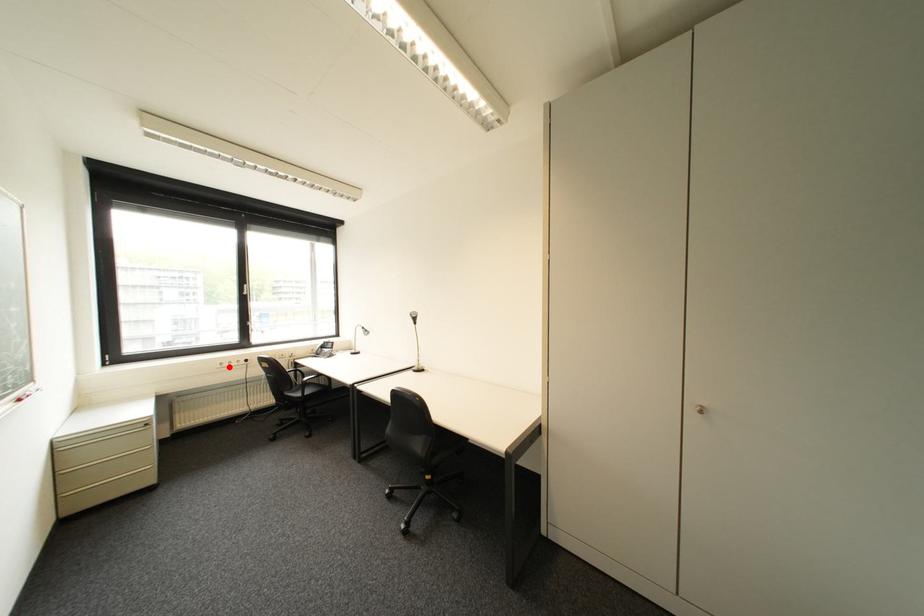
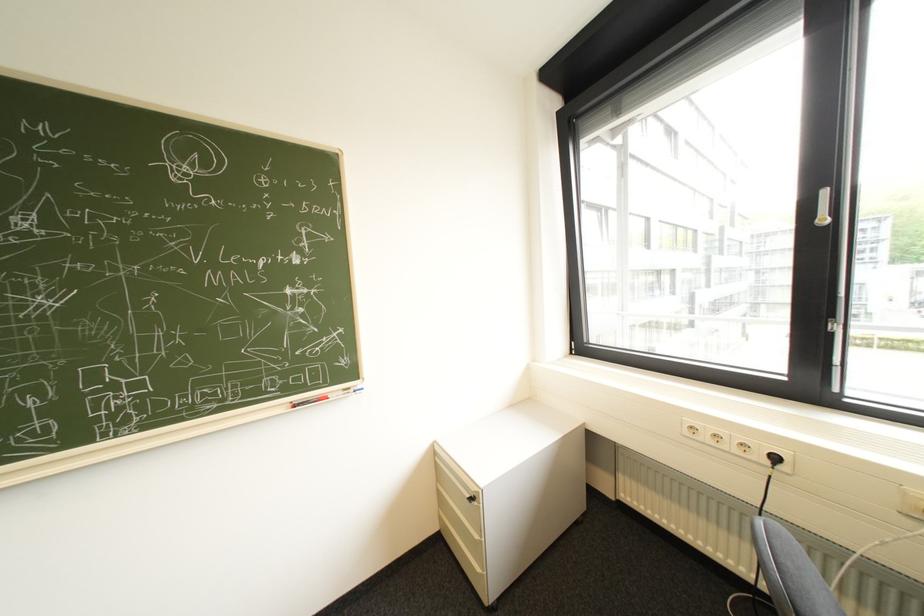
Where in the second image is the point corresponding to the highlighted location from the first image?

(698, 434)